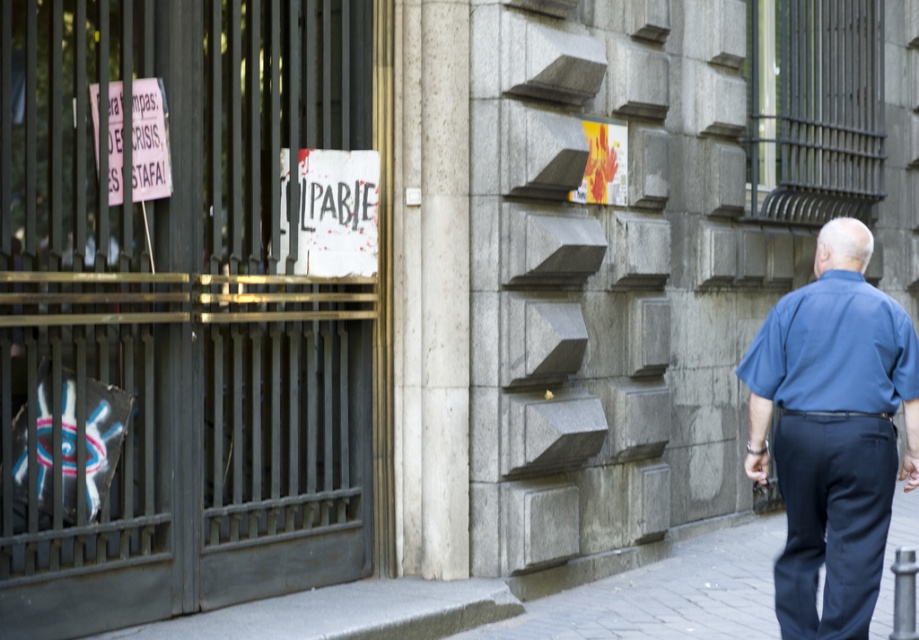
You are a pedestrian passing by the building and notice the blue cotton shirt at right and the white paper sign at center. Which object is located to the right of the other?

The blue cotton shirt at right is positioned on the right side of white paper sign at center.